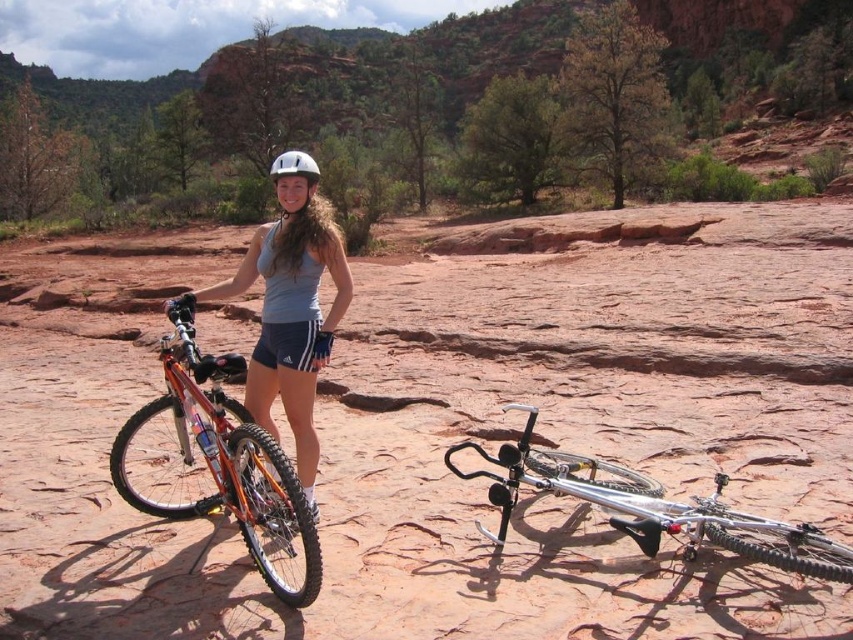
Question: Is dirt field at center smaller than orange matte mountain bike at left?

Choices:
 (A) no
 (B) yes

Answer: (A)

Question: Can you confirm if orange matte mountain bike at left is smaller than white matte helmet at center?

Choices:
 (A) yes
 (B) no

Answer: (A)

Question: Which is farther from the silver metallic bicycle at lower right?

Choices:
 (A) dirt field at center
 (B) matte gray tank top at center

Answer: (A)

Question: Is silver metallic bicycle at lower right positioned before white matte helmet at center?

Choices:
 (A) no
 (B) yes

Answer: (B)

Question: Which of the following is the farthest from the observer?

Choices:
 (A) dirt field at center
 (B) orange matte mountain bike at left
 (C) silver metallic bicycle at lower right
 (D) white matte helmet at center

Answer: (D)

Question: Which of the following is the closest to the observer?

Choices:
 (A) white matte helmet at center
 (B) matte gray tank top at center

Answer: (B)